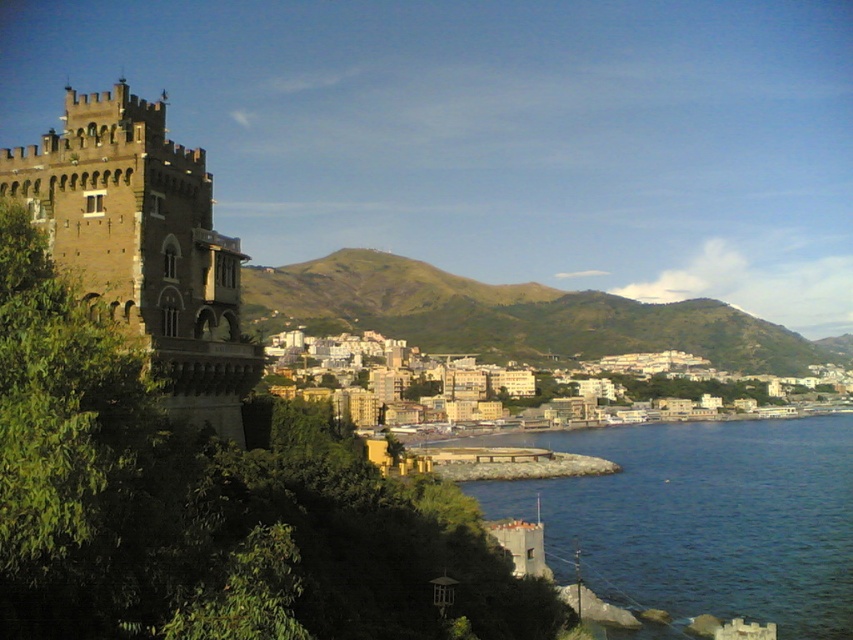
You are a tourist standing at the base of the medieval tower. You want to walk to the blue liquid water at lower right. Is the green grassy hillside at center between you and the water?

The blue liquid water at lower right is 99.16 meters away from the green grassy hillside at center. Since you are at the base of the tower, which is on the left side of the frame, the green grassy hillside at center is between you and the blue liquid water at lower right.

You are a tourist standing at the base of the medieval tower and want to take a photo of the blue liquid water at lower right and the beige concrete buildings at center. Which object should you point your camera towards first if you want to capture both in a single frame without moving the camera?

You should point your camera towards the blue liquid water at lower right first because it is located to the left of the beige concrete buildings at center, allowing both to be captured in the same frame without moving the camera.

You are an architect planning to build a new structure between the brown stone tower at left and the green grassy hillside at center. Considering their widths, which object should you place closer to the narrower side to maintain balance?

The brown stone tower at left has a lesser width compared to the green grassy hillside at center. To maintain balance, you should place the new structure closer to the brown stone tower at left since it is narrower.